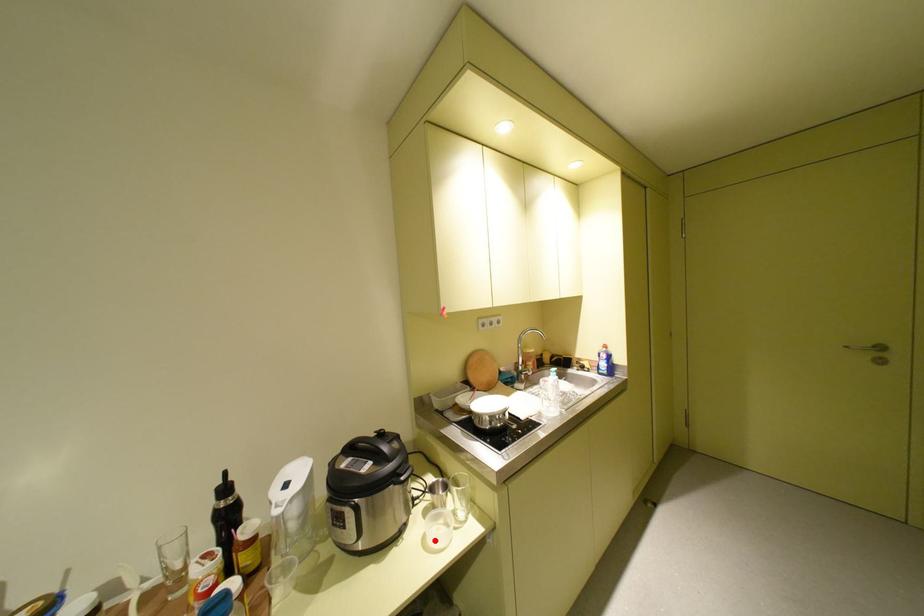
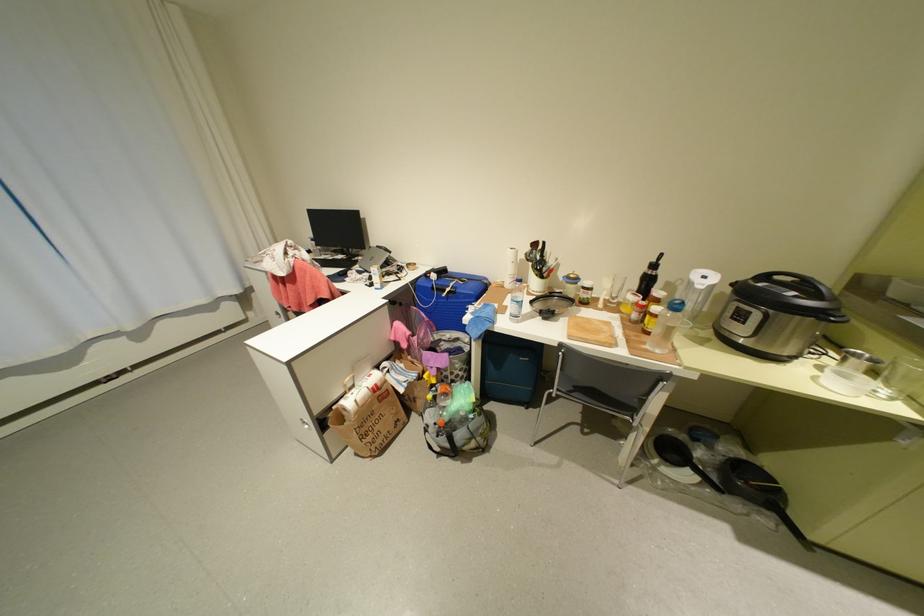
Find the pixel in the second image that matches the highlighted location in the first image.

(824, 379)